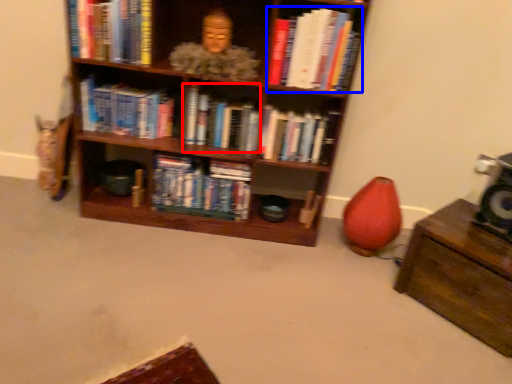
Question: Which point is further to the camera, book (highlighted by a red box) or book (highlighted by a blue box)?

Choices:
 (A) book
 (B) book

Answer: (A)